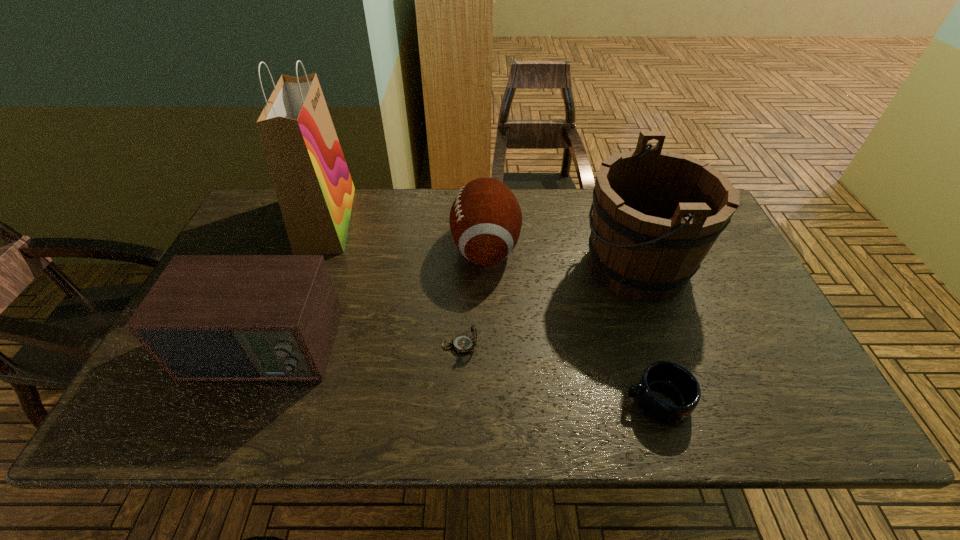
Image resolution: width=960 pixels, height=540 pixels. Find the location of `football that is at the far edge`. football that is at the far edge is located at coordinates (485, 219).

Find the location of a particular element. The width and height of the screenshot is (960, 540). object that is positioned at the near edge is located at coordinates [667, 392].

What are the coordinates of `shopping bag at the left edge` in the screenshot? It's located at (315, 191).

At what (x,y) coordinates should I click in order to perform the action: click on radio receiver that is at the left edge. Please return your answer as a coordinate pair (x, y). Looking at the image, I should click on (208, 317).

The width and height of the screenshot is (960, 540). In order to click on object that is positioned at the right edge in this screenshot , I will do `click(656, 214)`.

At what (x,y) coordinates should I click in order to perform the action: click on object that is at the far left corner. Please return your answer as a coordinate pair (x, y). Image resolution: width=960 pixels, height=540 pixels. Looking at the image, I should click on (315, 191).

Image resolution: width=960 pixels, height=540 pixels. Identify the location of object that is at the far right corner. (656, 214).

This screenshot has height=540, width=960. I want to click on free region at the far edge of the desktop, so click(443, 194).

Where is `free space at the near edge of the desktop`? Image resolution: width=960 pixels, height=540 pixels. free space at the near edge of the desktop is located at coordinates (379, 397).

You are a GUI agent. You are given a task and a screenshot of the screen. Output one action in this format:
    pyautogui.click(x=<x>, y=<y>)
    Task: Click on the vacant position at the right edge of the desktop
    
    Given the screenshot: What is the action you would take?
    pyautogui.click(x=725, y=281)